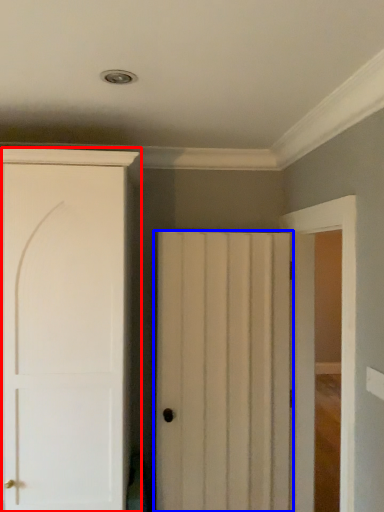
Question: Which object appears closest to the camera in this image, door (highlighted by a red box) or door (highlighted by a blue box)?

Choices:
 (A) door
 (B) door

Answer: (A)